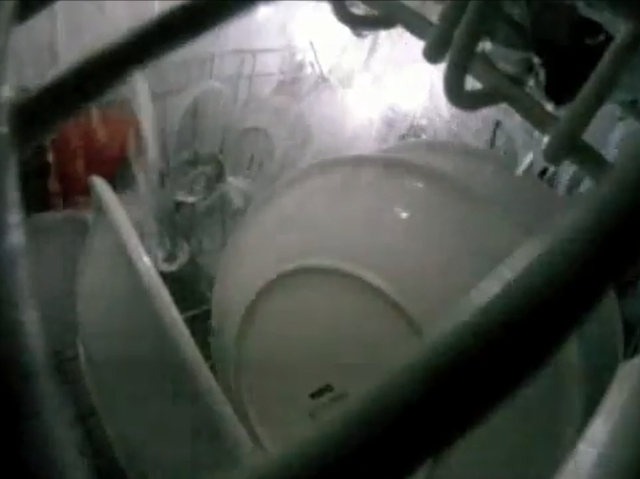
Find the location of `large white bowls`. large white bowls is located at coordinates (418, 200), (134, 354), (516, 190).